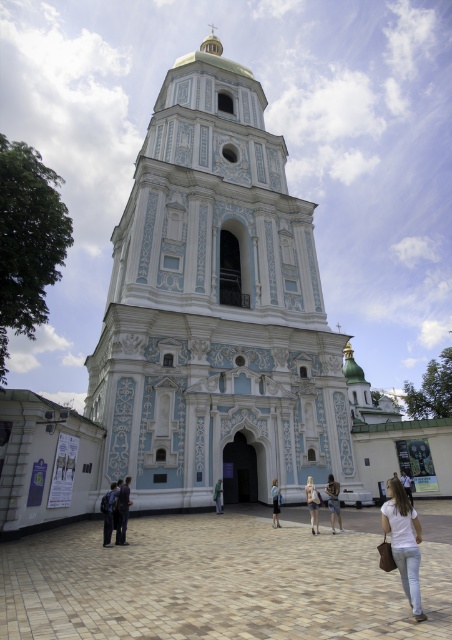
Question: Which point is farther to the camera?

Choices:
 (A) click(122, 545)
 (B) click(334, 451)

Answer: (B)

Question: Is denim pants at lower left behind green fabric jacket at center?

Choices:
 (A) no
 (B) yes

Answer: (A)

Question: Which of these objects is positioned closest to the white painted stone tower at center?

Choices:
 (A) dark blue jeans at lower left
 (B) denim pants at lower left

Answer: (B)

Question: Which point is closer to the camera?

Choices:
 (A) (405, 561)
 (B) (173, 380)
 (C) (409, 483)

Answer: (A)

Question: Does denim pants at lower left have a lesser width compared to light blue denim jeans at center?

Choices:
 (A) no
 (B) yes

Answer: (A)

Question: Is the position of light brown leather jacket at center less distant than that of gold metallic spire at upper center?

Choices:
 (A) no
 (B) yes

Answer: (B)